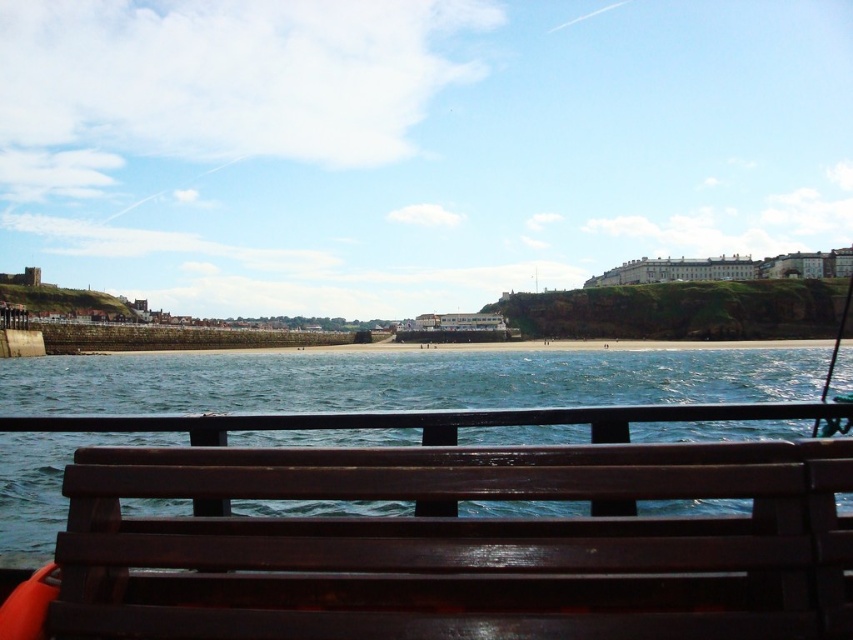
Question: Is dark wood bench at lower center smaller than metallic fishing pole at right?

Choices:
 (A) yes
 (B) no

Answer: (A)

Question: Does dark wood bench at lower center have a smaller size compared to metallic fishing pole at right?

Choices:
 (A) yes
 (B) no

Answer: (A)

Question: Is dark wood bench at lower center above metallic fishing pole at right?

Choices:
 (A) yes
 (B) no

Answer: (B)